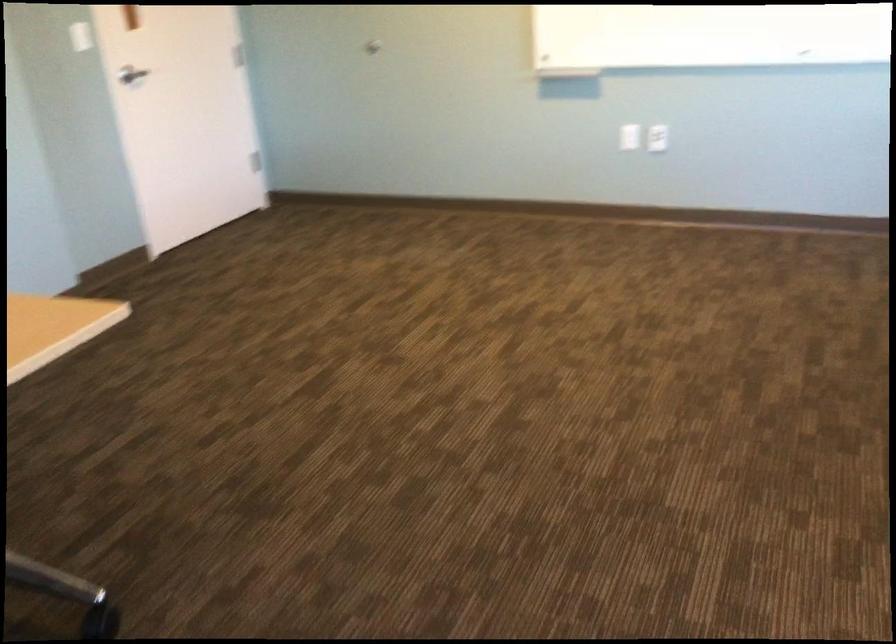
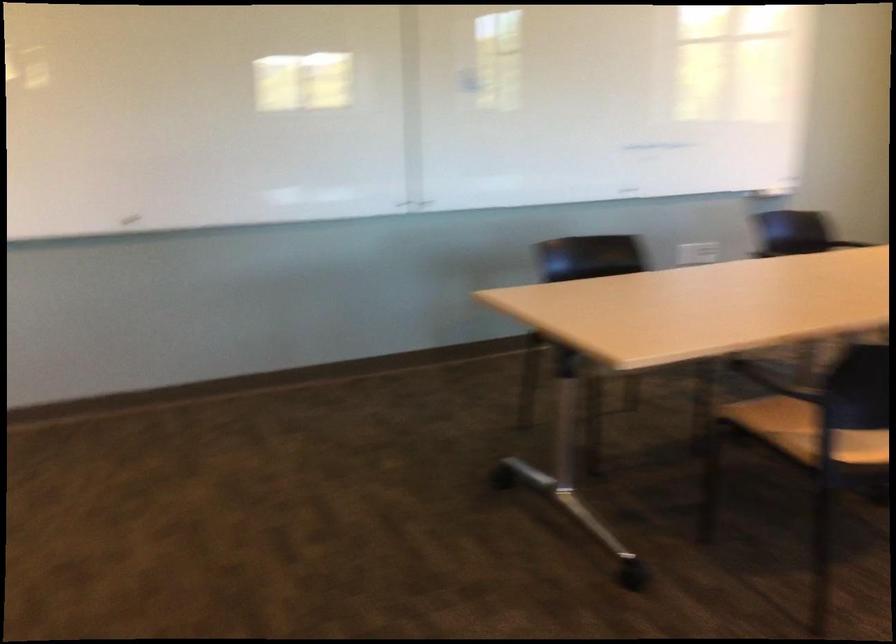
Question: How did the camera likely rotate?

Choices:
 (A) Left
 (B) Right
 (C) Up
 (D) Down

Answer: (B)